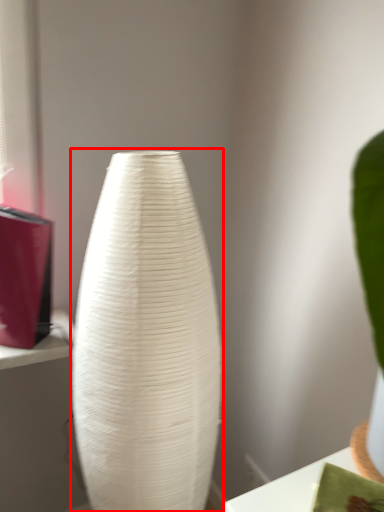
Question: From the image's perspective, considering the relative positions of vase (annotated by the red box) and table in the image provided, where is vase (annotated by the red box) located with respect to the staircase?

Choices:
 (A) above
 (B) below

Answer: (B)